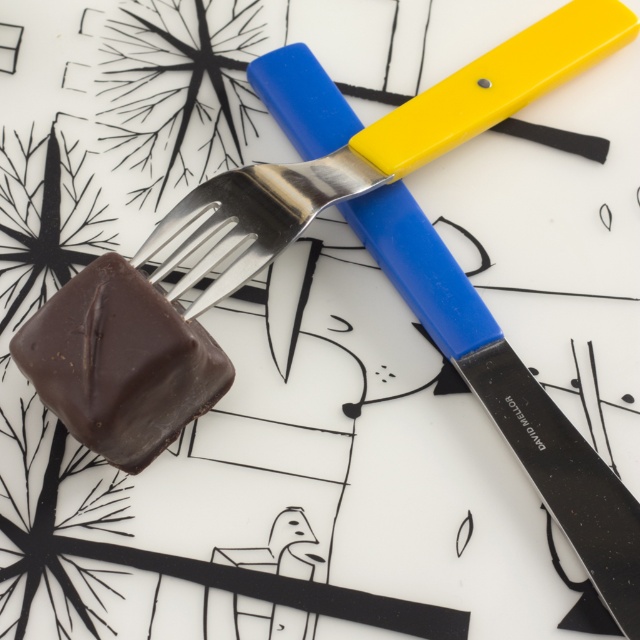
Does point (248, 184) lie behind point (80, 301)?

Yes.

Is shiny metal fork at lower left bigger than chocolatesmoothchocolate cube at left?

Yes.

Is point (236, 241) positioned in front of point (54, 330)?

No, (236, 241) is further to viewer.

Identify the location of shiny metal fork at lower left. This screenshot has height=640, width=640. (380, 148).